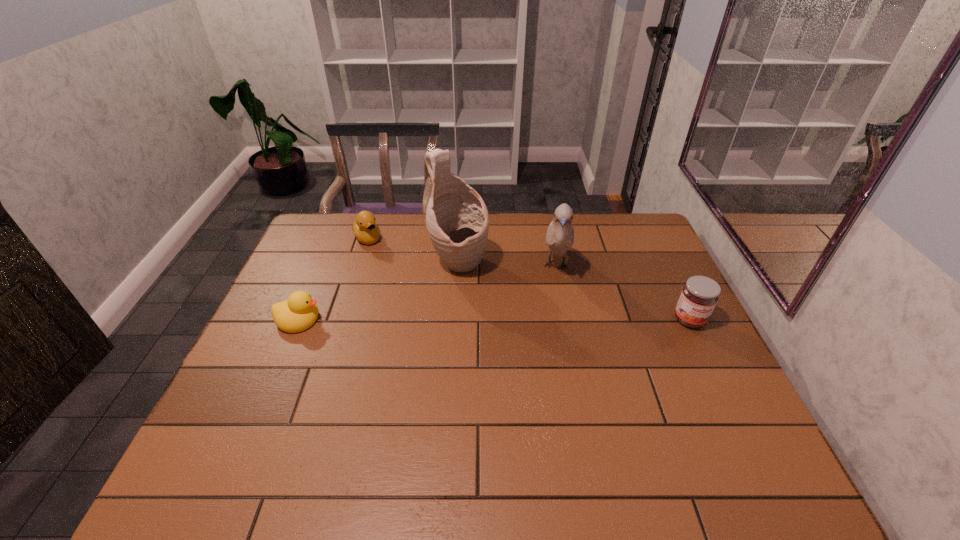
Select which object is the fourth closest to the third object from left to right. Please provide its 2D coordinates. Your answer should be formatted as a tuple, i.e. [(x, y)], where the tuple contains the x and y coordinates of a point satisfying the conditions above.

[(699, 296)]

This screenshot has width=960, height=540. In order to click on free space that satisfies the following two spatial constraints: 1. on the front side of the jam; 2. on the left side of the pitcher in this screenshot , I will do `click(456, 320)`.

Where is `free location that satisfies the following two spatial constraints: 1. on the front side of the third object from left to right; 2. on the right side of the farther duckling`? free location that satisfies the following two spatial constraints: 1. on the front side of the third object from left to right; 2. on the right side of the farther duckling is located at coordinates (358, 265).

Where is `vacant point that satisfies the following two spatial constraints: 1. on the front side of the pitcher; 2. on the right side of the second object from right to left`? vacant point that satisfies the following two spatial constraints: 1. on the front side of the pitcher; 2. on the right side of the second object from right to left is located at coordinates tap(459, 266).